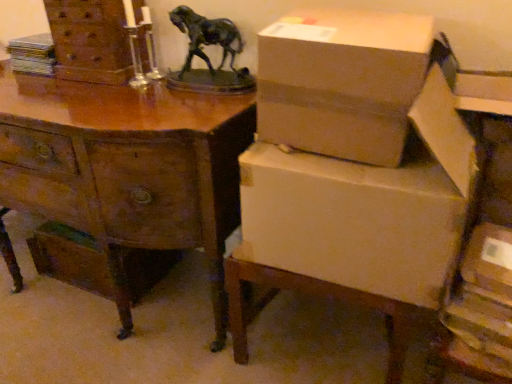
Identify the location of wooden desk at center. (128, 176).

What is the approximate height of matte cardboard box at lower right?

matte cardboard box at lower right is 2.13 inches tall.

The width and height of the screenshot is (512, 384). Find the location of `wooden chest of drawers at upper left`. wooden chest of drawers at upper left is located at coordinates (90, 40).

At what (x,y) coordinates should I click in order to perform the action: click on cardboard box at upper right. Please return your answer as a coordinate pair (x, y). Image resolution: width=512 pixels, height=384 pixels. Looking at the image, I should click on (343, 81).

Can we say wooden desk at center lies outside wooden chest of drawers at upper left?

That's correct, wooden desk at center is outside of wooden chest of drawers at upper left.

From a real-world perspective, between wooden desk at center and wooden chest of drawers at upper left, who is vertically lower?

In real-world perspective, wooden desk at center is lower.

In the image, is wooden desk at center positioned in front of or behind wooden chest of drawers at upper left?

Clearly, wooden desk at center is in front of wooden chest of drawers at upper left.

Is wooden desk at center not near wooden chest of drawers at upper left?

That's not correct — wooden desk at center is a little close to wooden chest of drawers at upper left.

In the image, is wooden chest of drawers at upper left on the left side or the right side of matte cardboard box at lower right?

wooden chest of drawers at upper left is positioned on matte cardboard box at lower right's left side.

Is wooden chest of drawers at upper left far from matte cardboard box at lower right?

wooden chest of drawers at upper left is positioned a significant distance from matte cardboard box at lower right.

Is wooden chest of drawers at upper left thinner than matte cardboard box at lower right?

Indeed, wooden chest of drawers at upper left has a lesser width compared to matte cardboard box at lower right.

Which object is closer to the camera, wooden chest of drawers at upper left or matte cardboard box at lower right?

Positioned in front is matte cardboard box at lower right.

Is point (69, 71) closer to viewer compared to point (206, 238)?

No, it is not.

From the image's perspective, which one is positioned lower, wooden chest of drawers at upper left or wooden desk at center?

wooden desk at center is shown below in the image.

Image resolution: width=512 pixels, height=384 pixels. I want to click on desk on the left of the wooden chest of drawers at upper left, so click(x=128, y=176).

Measure the distance between wooden chest of drawers at upper left and wooden desk at center.

A distance of 35.31 centimeters exists between wooden chest of drawers at upper left and wooden desk at center.

From the image's perspective, which object appears higher, white cardboard box at lower right or wooden chest of drawers at upper left?

wooden chest of drawers at upper left is shown above in the image.

Is white cardboard box at lower right situated inside wooden chest of drawers at upper left or outside?

white cardboard box at lower right exists outside the volume of wooden chest of drawers at upper left.

Would you say white cardboard box at lower right is a long distance from wooden chest of drawers at upper left?

No, white cardboard box at lower right is not far from wooden chest of drawers at upper left.

How different are the orientations of wooden desk at center and matte cardboard box at lower right in degrees?

The facing directions of wooden desk at center and matte cardboard box at lower right are 6.5 degrees apart.

The height and width of the screenshot is (384, 512). In order to click on storage box on the right of wooden desk at center in this screenshot , I will do `click(489, 259)`.

Is wooden desk at center turned away from matte cardboard box at lower right?

No, wooden desk at center's orientation is not away from matte cardboard box at lower right.

Measure the distance from wooden desk at center to matte cardboard box at lower right.

They are 39.16 inches apart.

Considering the sizes of objects matte cardboard box at lower right and wooden chest of drawers at upper left in the image provided, who is bigger, matte cardboard box at lower right or wooden chest of drawers at upper left?

wooden chest of drawers at upper left is bigger.

Considering the positions of point (483, 248) and point (106, 67), is point (483, 248) closer or farther from the camera than point (106, 67)?

Point (483, 248) appears to be closer to the viewer than point (106, 67).

Can you tell me how much matte cardboard box at lower right and wooden chest of drawers at upper left differ in facing direction?

The angular difference between matte cardboard box at lower right and wooden chest of drawers at upper left is 7.51 degrees.

Which is more to the right, cardboard box at upper right or wooden desk at center?

Positioned to the right is cardboard box at upper right.

Which of these two, cardboard box at upper right or wooden desk at center, stands shorter?

cardboard box at upper right.

Looking at this image, from a real-world perspective, which is physically above, cardboard box at upper right or wooden desk at center?

cardboard box at upper right is physically above.

Find the location of `desk located underneath the wooden chest of drawers at upper left (from a real-world perspective)`. desk located underneath the wooden chest of drawers at upper left (from a real-world perspective) is located at coordinates (128, 176).

The image size is (512, 384). In order to click on chest of drawers above the matte cardboard box at lower right (from the image's perspective) in this screenshot , I will do [x=90, y=40].

Estimate the real-world distances between objects in this image. Which object is further from wooden chest of drawers at upper left, matte cardboard box at lower right or wooden desk at center?

matte cardboard box at lower right lies further to wooden chest of drawers at upper left than the other object.

Estimate the real-world distances between objects in this image. Which object is further from wooden chest of drawers at upper left, wooden desk at center or cardboard box at upper right?

Among the two, cardboard box at upper right is located further to wooden chest of drawers at upper left.

Which object lies nearer to the anchor point matte cardboard box at lower right, wooden chest of drawers at upper left or cardboard box at upper right?

cardboard box at upper right is closer to matte cardboard box at lower right.

Considering their positions, is wooden chest of drawers at upper left positioned closer to cardboard box at upper right than wooden desk at center?

wooden desk at center lies closer to cardboard box at upper right than the other object.

Based on their spatial positions, is wooden desk at center or white cardboard box at lower right closer to matte cardboard box at lower right?

Based on the image, white cardboard box at lower right appears to be nearer to matte cardboard box at lower right.

Looking at the image, which one is located further to wooden desk at center, cardboard box at upper right or matte cardboard box at lower right?

Based on the image, matte cardboard box at lower right appears to be further to wooden desk at center.

From the image, which object appears to be nearer to wooden desk at center, wooden chest of drawers at upper left or white cardboard box at lower right?

wooden chest of drawers at upper left is closer to wooden desk at center.

From the picture: Looking at the image, which one is located closer to wooden desk at center, cardboard box at upper right or wooden chest of drawers at upper left?

The object closer to wooden desk at center is wooden chest of drawers at upper left.

Where is `box between wooden chest of drawers at upper left and matte cardboard box at lower right`? The width and height of the screenshot is (512, 384). box between wooden chest of drawers at upper left and matte cardboard box at lower right is located at coordinates (343, 81).

Identify the location of box situated between wooden chest of drawers at upper left and white cardboard box at lower right from left to right. This screenshot has width=512, height=384. (343, 81).

At what (x,y) coordinates should I click in order to perform the action: click on cardboard box located between wooden desk at center and matte cardboard box at lower right in the left-right direction. Please return your answer as a coordinate pair (x, y). Looking at the image, I should click on (366, 208).

Find the location of a particular element. This screenshot has width=512, height=384. box between wooden desk at center and matte cardboard box at lower right in the horizontal direction is located at coordinates (343, 81).